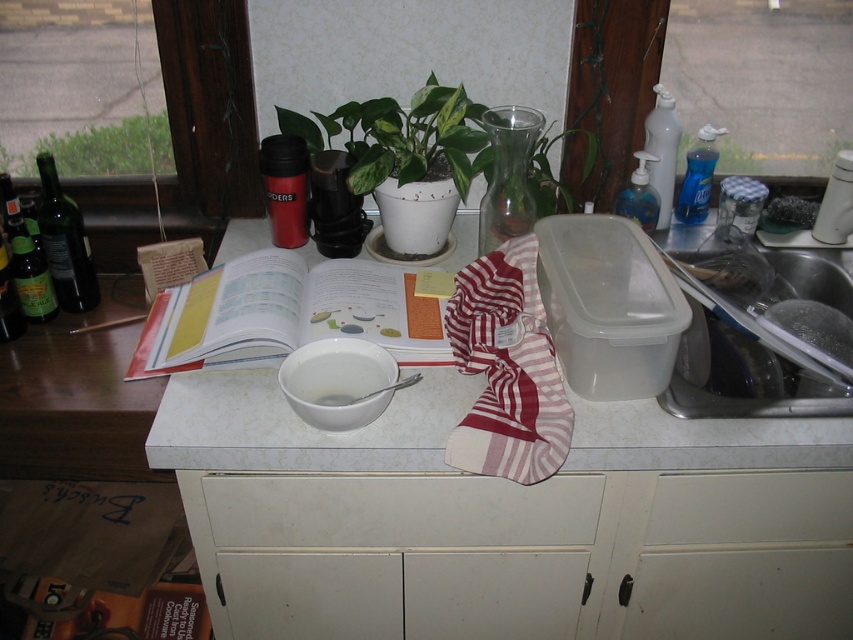
Which is in front, point (369, 317) or point (90, 269)?

Point (369, 317) is more forward.

Which is more to the right, matte paper book at center or green glass bottle at left?

From the viewer's perspective, matte paper book at center appears more on the right side.

Does point (251, 314) lie behind point (57, 230)?

No, (251, 314) is in front of (57, 230).

Find the location of `matte paper book at center`. matte paper book at center is located at coordinates (287, 314).

Identify the location of green leafy plant at upper center. Image resolution: width=853 pixels, height=640 pixels. (102, 148).

Between point (173, 166) and point (68, 212), which one is positioned behind?

Positioned behind is point (173, 166).

Is point (61, 140) farther from camera compared to point (54, 284)?

Yes, it is.

Identify the location of green leafy plant at upper center. Image resolution: width=853 pixels, height=640 pixels. (102, 148).

Does green glossy plant at upper center have a greater height compared to green glass bottle at left?

No.

What do you see at coordinates (402, 136) in the screenshot? The height and width of the screenshot is (640, 853). I see `green glossy plant at upper center` at bounding box center [402, 136].

Which is behind, point (358, 145) or point (90, 260)?

The point (90, 260) is behind.

Where is `green glossy plant at upper center`? green glossy plant at upper center is located at coordinates (402, 136).